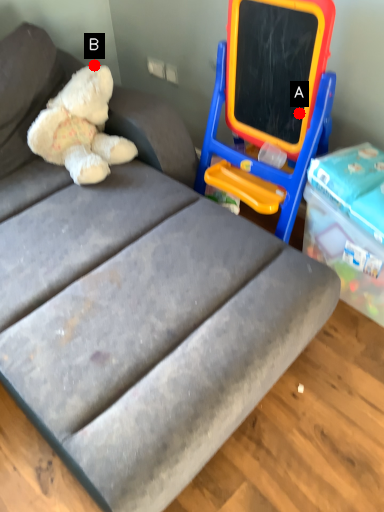
Question: Two points are circled on the image, labeled by A and B beside each circle. Which point is further to the camera?

Choices:
 (A) A is further
 (B) B is further

Answer: (B)